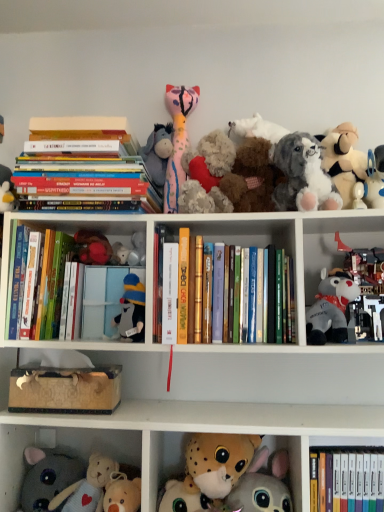
I want to click on fluffy plush toy at center, placed as the 7th toy when sorted from right to left, so click(132, 310).

Find the location of a particular element. hardcover book at center, which is the 1th paperback book from right to left is located at coordinates (183, 285).

Image resolution: width=384 pixels, height=512 pixels. Describe the element at coordinates (178, 140) in the screenshot. I see `soft pink plush toy at upper center, arranged as the 4th toy when viewed from the left` at that location.

This screenshot has width=384, height=512. I want to click on fluffy white plush at lower center, the fifth toy when ordered from left to right, so click(x=183, y=497).

Does point (65, 258) come in front of point (171, 227)?

Yes, point (65, 258) is closer to viewer.

Considering the sizes of hardcover book at left, the fourth book when ordered from right to left, and hardcover books at center, the 2th book viewed from the right, in the image, is hardcover book at left, the fourth book when ordered from right to left, wider or thinner than hardcover books at center, the 2th book viewed from the right,?

Considering their sizes, hardcover book at left, the fourth book when ordered from right to left, looks broader than hardcover books at center, the 2th book viewed from the right.

Considering the relative sizes of hardcover book at left, the fourth book when ordered from right to left, and hardcover books at center, the 2th book viewed from the right, in the image provided, is hardcover book at left, the fourth book when ordered from right to left, bigger than hardcover books at center, the 2th book viewed from the right,?

Yes, hardcover book at left, the fourth book when ordered from right to left, is bigger than hardcover books at center, the 2th book viewed from the right.

Based on the photo, is hardcover book at left, which appears as the third book when ordered from the bottom, closer to the viewer compared to hardcover books at center, acting as the second book starting from the bottom?

No, it is behind hardcover books at center, acting as the second book starting from the bottom.

From a real-world perspective, does hardcover book at left, the first book in the left-to-right sequence, sit lower than fluffy white stuffed animal at upper right, arranged as the ninth toy when viewed from the left?

Yes, from a real-world perspective, hardcover book at left, the first book in the left-to-right sequence, is below fluffy white stuffed animal at upper right, arranged as the ninth toy when viewed from the left.

Considering the relative positions of hardcover book at left, the first book in the left-to-right sequence, and fluffy white stuffed animal at upper right, the 1th toy from the right, in the image provided, is hardcover book at left, the first book in the left-to-right sequence, to the right of fluffy white stuffed animal at upper right, the 1th toy from the right, from the viewer's perspective?

Incorrect, hardcover book at left, the first book in the left-to-right sequence, is not on the right side of fluffy white stuffed animal at upper right, the 1th toy from the right.

Which is in front, hardcover book at left, the fourth book when ordered from right to left, or fluffy white stuffed animal at upper right, arranged as the ninth toy when viewed from the left?

hardcover book at left, the fourth book when ordered from right to left, is in front.

Is hardcover book at center, the fourth book from the left, at the back of fluffy plush toys at lower left, arranged as the first cabinet when ordered from the bottom?

No, hardcover book at center, the fourth book from the left, is not at the back of fluffy plush toys at lower left, arranged as the first cabinet when ordered from the bottom.

Is fluffy plush toys at lower left, which is counted as the 2th cabinet, starting from the right, far from hardcover book at center, the fourth book from the left?

No, fluffy plush toys at lower left, which is counted as the 2th cabinet, starting from the right, is not far from hardcover book at center, the fourth book from the left.

Consider the image. Considering the relative positions of fluffy plush toys at lower left, which is the 1th cabinet from left to right, and hardcover book at center, which is the first book from bottom to top, in the image provided, is fluffy plush toys at lower left, which is the 1th cabinet from left to right, in front of hardcover book at center, which is the first book from bottom to top,?

No, it is not.

Considering the positions of objects fluffy white plush at lower center, which is the fifth toy from right to left, and fluffy plush toys at lower left, which is the 1th cabinet from left to right, in the image provided, who is more to the left, fluffy white plush at lower center, which is the fifth toy from right to left, or fluffy plush toys at lower left, which is the 1th cabinet from left to right,?

Positioned to the left is fluffy plush toys at lower left, which is the 1th cabinet from left to right.

Is fluffy white plush at lower center, the fifth toy when ordered from left to right, oriented away from fluffy plush toys at lower left, which is counted as the 2th cabinet, starting from the right?

No.

Between fluffy white plush at lower center, the fifth toy when ordered from left to right, and fluffy plush toys at lower left, marked as the second cabinet in a top-to-bottom arrangement, which one has less height?

fluffy white plush at lower center, the fifth toy when ordered from left to right, is shorter.

Would you consider fluffy white plush at lower center, which is the fifth toy from right to left, to be distant from fluffy plush toys at lower left, which is counted as the 2th cabinet, starting from the right?

No.

Are hardcover books at upper left, positioned as the second book in left-to-right order, and fluffy gray dog at upper right, which is counted as the 7th toy, starting from the left, far apart?

Actually, hardcover books at upper left, positioned as the second book in left-to-right order, and fluffy gray dog at upper right, which is counted as the 7th toy, starting from the left, are a little close together.

Which point is more distant from viewer, (45, 146) or (301, 165)?

Positioned behind is point (45, 146).

Which is more to the left, hardcover books at upper left, positioned as the second book in left-to-right order, or fluffy gray dog at upper right, which is counted as the 7th toy, starting from the left?

Positioned to the left is hardcover books at upper left, positioned as the second book in left-to-right order.

How different are the orientations of hardcover books at upper left, the 4th book ordered from the bottom, and fluffy gray dog at upper right, placed as the 3th toy when sorted from right to left, in degrees?

The angle between the facing direction of hardcover books at upper left, the 4th book ordered from the bottom, and the facing direction of fluffy gray dog at upper right, placed as the 3th toy when sorted from right to left, is 0.342 degrees.

Which is more to the right, fluffy white plush at lower center, which is the fifth toy from right to left, or fluffy pink stuffed animal at upper center, which ranks as the fourth toy in right-to-left order?

fluffy pink stuffed animal at upper center, which ranks as the fourth toy in right-to-left order, is more to the right.

Measure the distance between fluffy white plush at lower center, which is the fifth toy from right to left, and fluffy pink stuffed animal at upper center, acting as the 6th toy starting from the left.

fluffy white plush at lower center, which is the fifth toy from right to left, is 27.47 inches from fluffy pink stuffed animal at upper center, acting as the 6th toy starting from the left.

Which of these two, fluffy white plush at lower center, the fifth toy when ordered from left to right, or fluffy pink stuffed animal at upper center, acting as the 6th toy starting from the left, is bigger?

With larger size is fluffy pink stuffed animal at upper center, acting as the 6th toy starting from the left.

Can you confirm if fluffy white plush at lower center, which is the fifth toy from right to left, is thinner than fluffy pink stuffed animal at upper center, which ranks as the fourth toy in right-to-left order?

Yes.

Is hardcover book at center, the 2th paperback book positioned from the left, thinner than fluffy white stuffed animal at upper right, the 1th toy from the right?

Incorrect, the width of hardcover book at center, the 2th paperback book positioned from the left, is not less than that of fluffy white stuffed animal at upper right, the 1th toy from the right.

From a real-world perspective, between hardcover book at center, which is the 1th paperback book from right to left, and fluffy white stuffed animal at upper right, arranged as the ninth toy when viewed from the left, who is vertically lower?

In real-world perspective, hardcover book at center, which is the 1th paperback book from right to left, is lower.

Could you tell me if hardcover book at center, the 2th paperback book positioned from the left, is turned towards fluffy white stuffed animal at upper right, the 1th toy from the right?

No, hardcover book at center, the 2th paperback book positioned from the left, is not oriented towards fluffy white stuffed animal at upper right, the 1th toy from the right.

From the image's perspective, would you say hardcover book at center, which is the 1th paperback book from right to left, is positioned over fluffy white stuffed animal at upper right, the 1th toy from the right?

No, from the image's perspective, hardcover book at center, which is the 1th paperback book from right to left, is not above fluffy white stuffed animal at upper right, the 1th toy from the right.

The width and height of the screenshot is (384, 512). Find the location of `the 1st book above the hardcover books at center, marked as the third book in a top-to-bottom arrangement (from the image's perspective)`. the 1st book above the hardcover books at center, marked as the third book in a top-to-bottom arrangement (from the image's perspective) is located at coordinates (47, 287).

There is a fluffy white stuffed animal at upper right, arranged as the ninth toy when viewed from the left. Identify the location of the 2nd book below it (from the image's perspective). This screenshot has height=512, width=384. (47, 287).

From the image, which object appears to be farther from gray plush toy at right, which ranks as the 2th toy in right-to-left order, velvet plush bear at center, which is the 8th toy in right-to-left order, or white plush toy at upper right, which is counted as the second cabinet, starting from the left?

velvet plush bear at center, which is the 8th toy in right-to-left order, is positioned further to the anchor gray plush toy at right, which ranks as the 2th toy in right-to-left order.

Estimate the real-world distances between objects in this image. Which object is further from fluffy gray dog at upper right, placed as the 3th toy when sorted from right to left, soft plush elephant at lower left, marked as the first toy in a left-to-right arrangement, or fluffy white plush at lower center, which is the fifth toy from right to left?

soft plush elephant at lower left, marked as the first toy in a left-to-right arrangement, lies further to fluffy gray dog at upper right, placed as the 3th toy when sorted from right to left, than the other object.

Based on their spatial positions, is hardcover book at center, the 2th paperback book positioned from the left, or soft pink plush toy at upper center, arranged as the 4th toy when viewed from the left, closer to fluffy white plush at lower center, which is the fifth toy from right to left?

hardcover book at center, the 2th paperback book positioned from the left, lies closer to fluffy white plush at lower center, which is the fifth toy from right to left, than the other object.

Based on their spatial positions, is soft pink plush toy at upper center, arranged as the 4th toy when viewed from the left, or fluffy white stuffed animal at upper right, arranged as the ninth toy when viewed from the left, further from fluffy plush toy at center, which is the third toy from left to right?

fluffy white stuffed animal at upper right, arranged as the ninth toy when viewed from the left.

From the image, which object appears to be nearer to white plush toy at upper right, the first cabinet from the right, fluffy plush toys at lower left, which is counted as the 2th cabinet, starting from the right, or fluffy white stuffed animal at upper right, the 1th toy from the right?

fluffy white stuffed animal at upper right, the 1th toy from the right, is positioned closer to the anchor white plush toy at upper right, the first cabinet from the right.

Estimate the real-world distances between objects in this image. Which object is closer to gray plush toy at right, which ranks as the 2th toy in right-to-left order, velvet plush bear at center, which is the 8th toy in right-to-left order, or soft plush elephant at lower left, marked as the first toy in a left-to-right arrangement?

Among the two, velvet plush bear at center, which is the 8th toy in right-to-left order, is located nearer to gray plush toy at right, which ranks as the 2th toy in right-to-left order.

Which object lies further to the anchor point fluffy gray dog at upper right, placed as the 3th toy when sorted from right to left, fluffy white stuffed animal at upper right, arranged as the ninth toy when viewed from the left, or hardcover books at center, marked as the third book in a top-to-bottom arrangement?

The object further to fluffy gray dog at upper right, placed as the 3th toy when sorted from right to left, is hardcover books at center, marked as the third book in a top-to-bottom arrangement.

Which object lies nearer to the anchor point hardcover books at upper left, positioned as the second book in left-to-right order, hardcover book at center, the fourth book from the left, or soft pink plush toy at upper center, arranged as the 4th toy when viewed from the left?

The object closer to hardcover books at upper left, positioned as the second book in left-to-right order, is soft pink plush toy at upper center, arranged as the 4th toy when viewed from the left.

Find the location of `cabinet between fluffy gray dog at upper right, which is counted as the 7th toy, starting from the left, and fluffy plush toys at lower left, marked as the second cabinet in a top-to-bottom arrangement, in the vertical direction`. cabinet between fluffy gray dog at upper right, which is counted as the 7th toy, starting from the left, and fluffy plush toys at lower left, marked as the second cabinet in a top-to-bottom arrangement, in the vertical direction is located at coordinates (336, 243).

The width and height of the screenshot is (384, 512). In order to click on paperback book that lies between hardcover books at center, marked as the third book in a top-to-bottom arrangement, and fluffy plush toys at lower left, marked as the second cabinet in a top-to-bottom arrangement, from top to bottom in this screenshot , I will do `click(170, 293)`.

Where is `shelf between soft pink plush toy at upper center, arranged as the 4th toy when viewed from the left, and hardcover book at center, marked as the 2th paperback book in a right-to-left arrangement, in the up-down direction`? Image resolution: width=384 pixels, height=512 pixels. shelf between soft pink plush toy at upper center, arranged as the 4th toy when viewed from the left, and hardcover book at center, marked as the 2th paperback book in a right-to-left arrangement, in the up-down direction is located at coordinates (228, 243).

I want to click on shelf between hardcover book at left, which appears as the third book when ordered from the bottom, and fluffy white stuffed animal at upper right, the 1th toy from the right, in the horizontal direction, so click(228, 243).